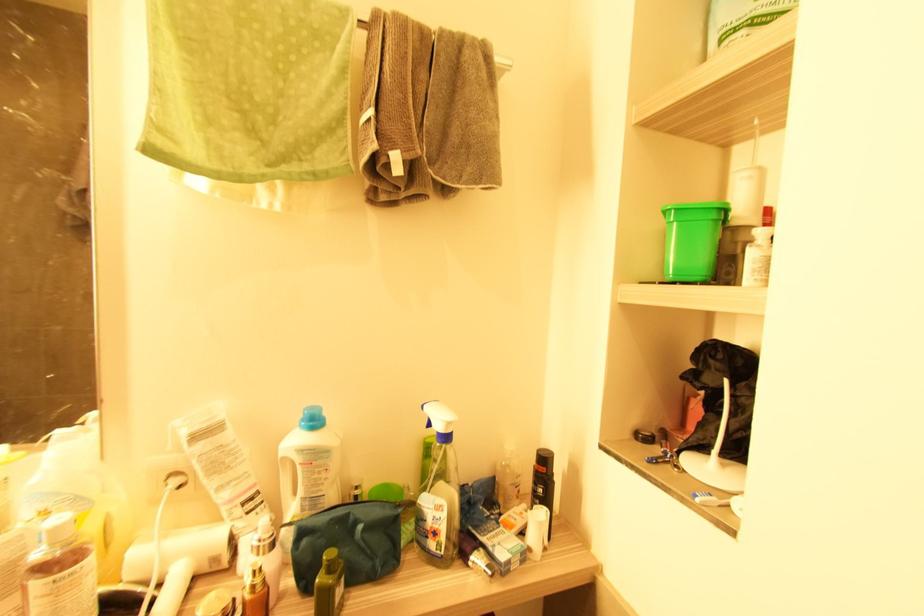
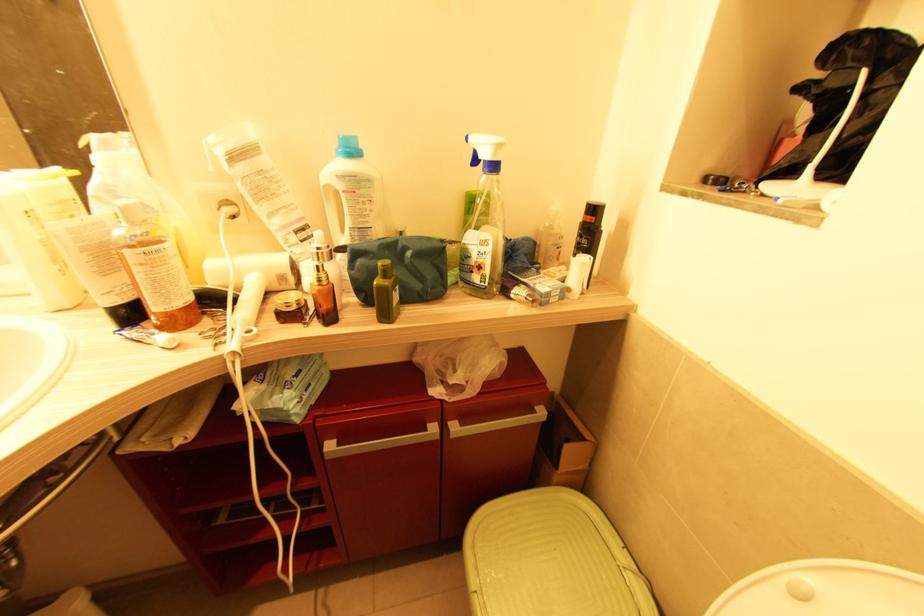
Where in the second image is the point corresponding to [726,382] from the first image?

(867, 73)